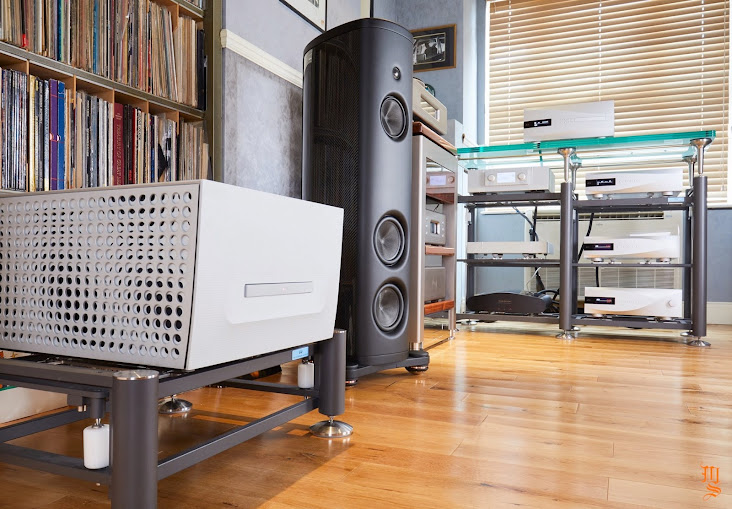
I want to click on tray / container, so click(157, 274).